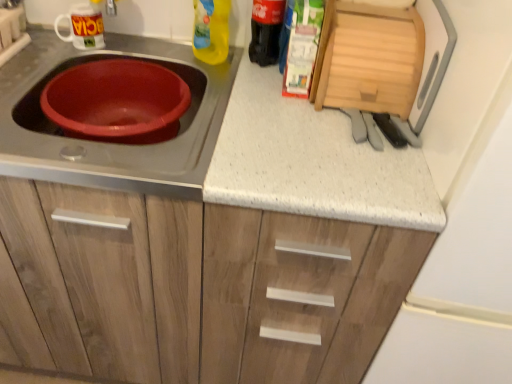
What are the coordinates of `free space that is to the left of wooden cutting board at upper right, the first appliance viewed from the right` in the screenshot? It's located at (259, 92).